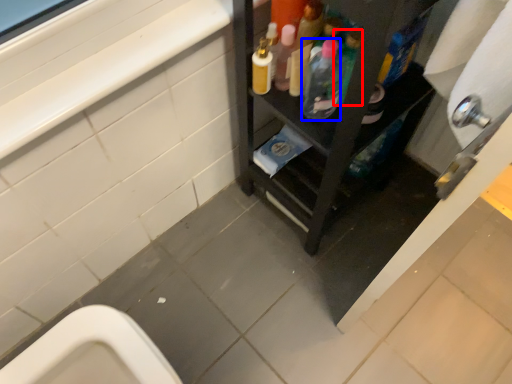
Question: Which object appears farthest to the camera in this image, bottle (highlighted by a red box) or bottle (highlighted by a blue box)?

Choices:
 (A) bottle
 (B) bottle

Answer: (B)